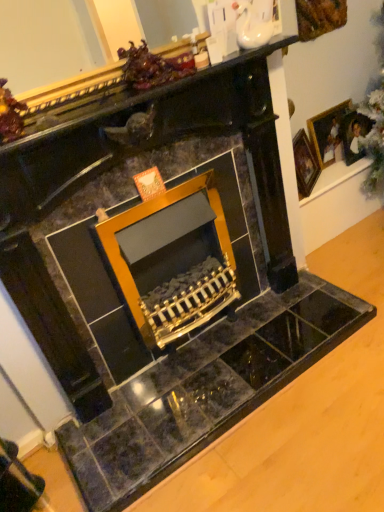
Question: Visually, is wooden picture frame at upper right, which appears as the 2th picture frame when viewed from the left, positioned to the left or to the right of gold-framed picture at upper right, acting as the second picture frame starting from the right?

Choices:
 (A) right
 (B) left

Answer: (A)

Question: Is wooden picture frame at upper right, which appears as the 2th picture frame when viewed from the left, situated inside gold-framed picture at upper right, which is the first picture frame from left to right, or outside?

Choices:
 (A) outside
 (B) inside

Answer: (A)

Question: Is wooden picture frame at upper right, which appears as the 2th picture frame when viewed from the left, taller or shorter than gold-framed picture at upper right, which is the first picture frame from left to right?

Choices:
 (A) tall
 (B) short

Answer: (B)

Question: Considering the positions of gold-framed picture at upper right, acting as the second picture frame starting from the right, and wooden picture frame at upper right, which is the 1th picture frame from right to left, in the image, is gold-framed picture at upper right, acting as the second picture frame starting from the right, bigger or smaller than wooden picture frame at upper right, which is the 1th picture frame from right to left,?

Choices:
 (A) small
 (B) big

Answer: (B)

Question: Considering the relative positions of gold-framed picture at upper right, acting as the second picture frame starting from the right, and wooden picture frame at upper right, which is the 1th picture frame from right to left, in the image provided, is gold-framed picture at upper right, acting as the second picture frame starting from the right, to the left or to the right of wooden picture frame at upper right, which is the 1th picture frame from right to left,?

Choices:
 (A) right
 (B) left

Answer: (B)

Question: In terms of height, does gold-framed picture at upper right, which is the first picture frame from left to right, look taller or shorter compared to wooden picture frame at upper right, which appears as the 2th picture frame when viewed from the left?

Choices:
 (A) short
 (B) tall

Answer: (B)

Question: From a real-world perspective, is gold-framed picture at upper right, acting as the second picture frame starting from the right, positioned above or below wooden picture frame at upper right, which appears as the 2th picture frame when viewed from the left?

Choices:
 (A) above
 (B) below

Answer: (B)